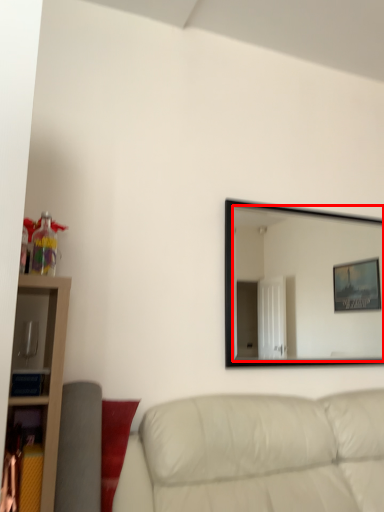
Question: Observing the image, what is the correct spatial positioning of mirror (annotated by the red box) in reference to studio couch?

Choices:
 (A) left
 (B) right

Answer: (B)